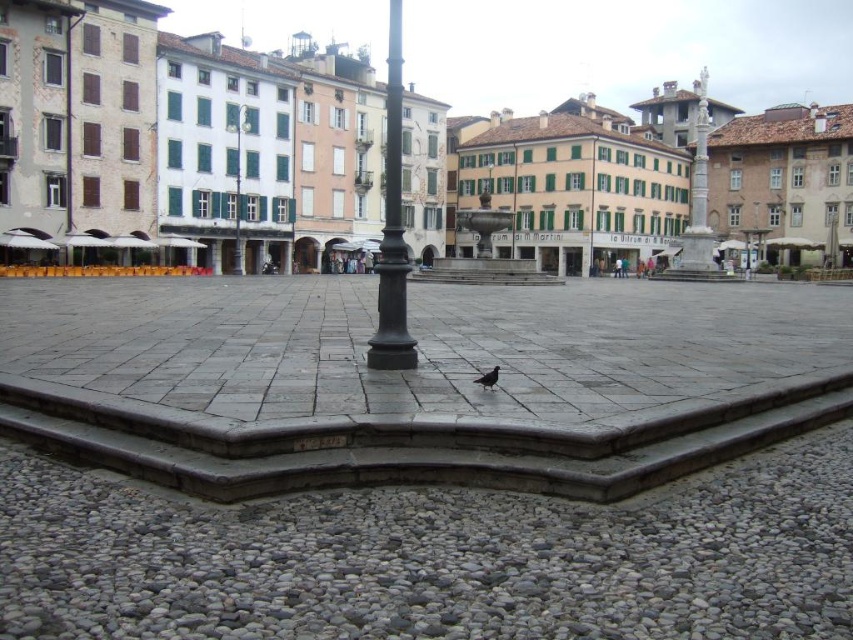
Consider the image. You are standing in the urban square and want to locate the black metal pole at center. According to the coordinates provided, where would you find it?

The black metal pole at center is located at the 2D coordinates point (392, 227).

You are standing at the center of the urban square and want to walk towards the point that is closer to the black lamppost. Which point should you walk towards, point (395, 282) or point (70, 16)?

Point (70, 16) is closer to the black lamppost, so you should walk towards point (70, 16).

You are a tourist in the square and want to take a photo of the brown matte bird at lower center with the black metal pole at center in the background. Can you position yourself so that the pole is to the left of the bird in the photo?

The black metal pole at center is positioned on the left side of the brown matte bird at lower center, so yes, you can position yourself to have the pole to the left of the bird in the photo.